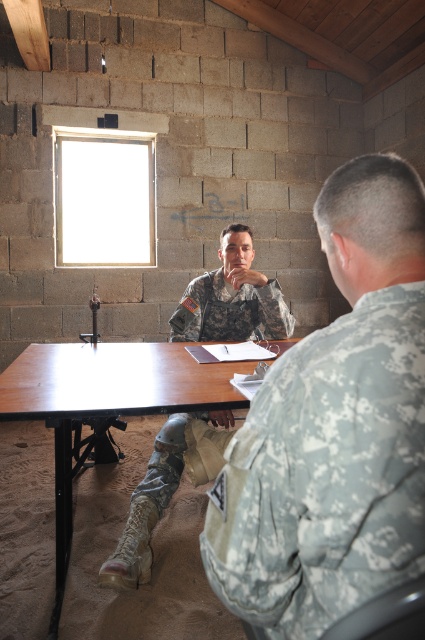
Question: Which is nearer to the brown wood table at center?

Choices:
 (A) camouflage fabric uniform at back
 (B) camouflage uniform at center

Answer: (B)

Question: Among these objects, which one is nearest to the camera?

Choices:
 (A) camouflage uniform at center
 (B) camouflage fabric uniform at back
 (C) brown wood table at center

Answer: (B)

Question: Can you confirm if camouflage fabric uniform at back is positioned to the right of camouflage uniform at center?

Choices:
 (A) yes
 (B) no

Answer: (A)

Question: Among these points, which one is farthest from the camera?

Choices:
 (A) (150, 356)
 (B) (243, 260)

Answer: (B)

Question: Where is camouflage fabric uniform at back located in relation to brown wood table at center in the image?

Choices:
 (A) below
 (B) above

Answer: (B)

Question: Is camouflage uniform at center to the right of brown wood table at center from the viewer's perspective?

Choices:
 (A) no
 (B) yes

Answer: (B)